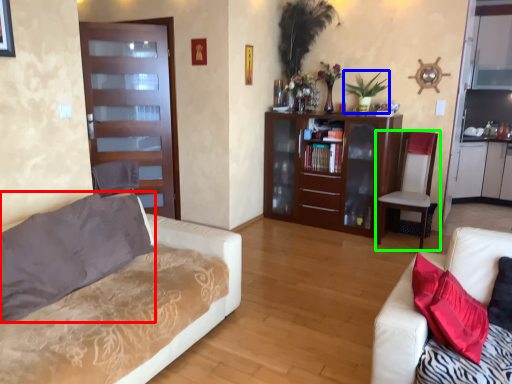
Question: Estimate the real-world distances between objects in this image. Which object is farther from pillow (highlighted by a red box), plant (highlighted by a blue box) or chair (highlighted by a green box)?

Choices:
 (A) plant
 (B) chair

Answer: (A)